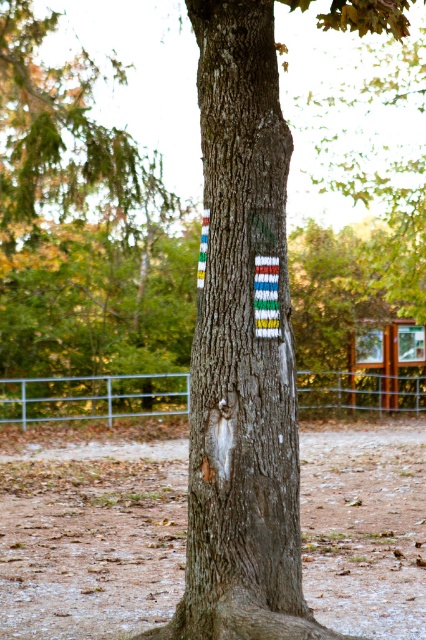
Question: Which of the following is the closest to the observer?

Choices:
 (A) (411, 467)
 (B) (212, 124)
 (C) (331, 390)

Answer: (B)

Question: Does dirt/dry soil at center have a smaller size compared to metallic silver fence at lower center?

Choices:
 (A) yes
 (B) no

Answer: (A)

Question: Which object is the farthest from the metallic silver fence at lower center?

Choices:
 (A) smooth bark tree trunk at center
 (B) dirt/dry soil at center

Answer: (A)

Question: Does smooth bark tree trunk at center have a larger size compared to metallic silver fence at lower center?

Choices:
 (A) yes
 (B) no

Answer: (B)

Question: Does dirt/dry soil at center lie in front of metallic silver fence at lower center?

Choices:
 (A) no
 (B) yes

Answer: (A)

Question: Which point is closer to the camera?

Choices:
 (A) (216, 307)
 (B) (167, 515)

Answer: (A)